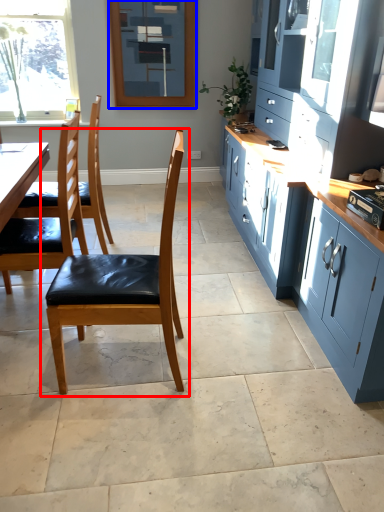
Question: Which point is closer to the camera, chair (highlighted by a red box) or window screen (highlighted by a blue box)?

Choices:
 (A) chair
 (B) window screen

Answer: (A)